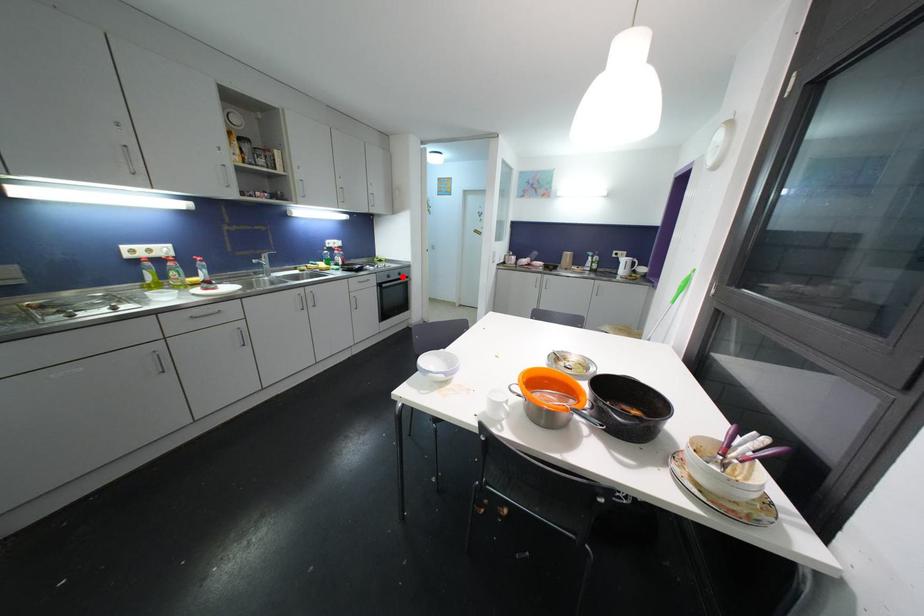
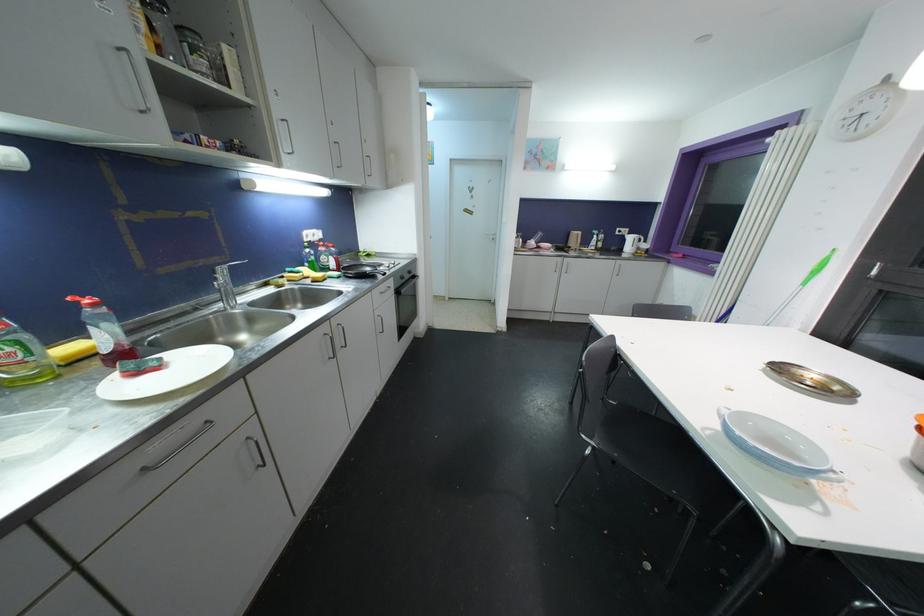
Question: I am providing you with two images of the same scene from different viewpoints. A red point is marked on the first image. Can you still see the location of the red point in image 2?

Choices:
 (A) Yes
 (B) No

Answer: (A)